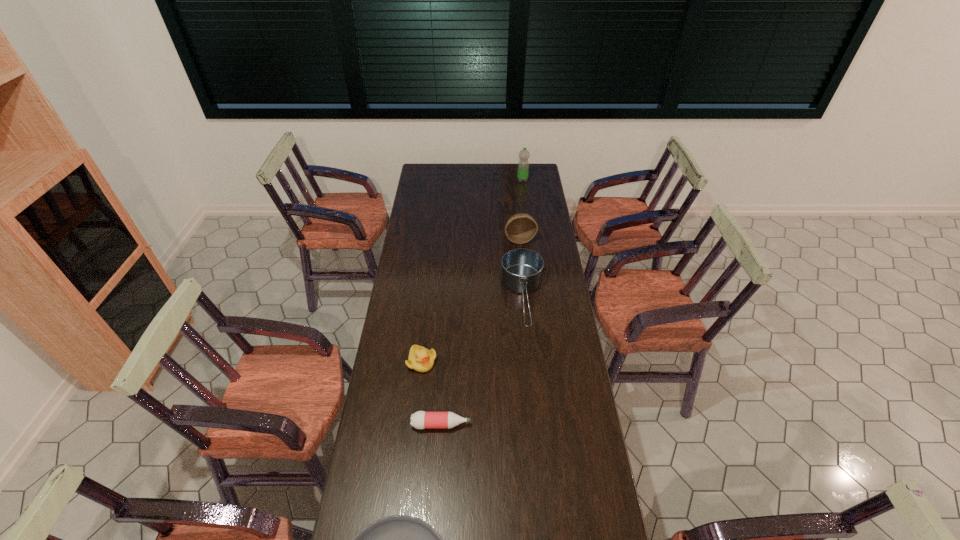
You are a GUI agent. You are given a task and a screenshot of the screen. Output one action in this format:
    pyautogui.click(x=<x>, y=<y>)
    Task: Click on the saucepan that is at the right edge
    This screenshot has width=960, height=540.
    Given the screenshot: What is the action you would take?
    pyautogui.click(x=521, y=269)

Where is `object at the far right corner`? The height and width of the screenshot is (540, 960). object at the far right corner is located at coordinates click(x=523, y=166).

This screenshot has height=540, width=960. In the image, there is a desktop. What are the coordinates of `vacant area at the far edge` in the screenshot? It's located at (473, 181).

Locate an element on the screen. The height and width of the screenshot is (540, 960). free space at the left edge of the desktop is located at coordinates (413, 212).

The width and height of the screenshot is (960, 540). In the image, there is a desktop. Identify the location of vacant space at the right edge. (545, 319).

In order to click on vacant space at the far left corner of the desktop in this screenshot , I will do `click(417, 176)`.

In the image, there is a desktop. At what (x,y) coordinates should I click in order to perform the action: click on blank space at the far right corner. Please return your answer as a coordinate pair (x, y). The width and height of the screenshot is (960, 540). Looking at the image, I should click on (531, 179).

Find the location of a particular element. This screenshot has height=540, width=960. free point between the fourth shortest object and the fourth farthest object is located at coordinates (472, 330).

Where is `free space between the fourth farthest object and the second farthest object`? free space between the fourth farthest object and the second farthest object is located at coordinates (470, 300).

I want to click on unoccupied area between the third shortest object and the fifth tallest object, so click(431, 393).